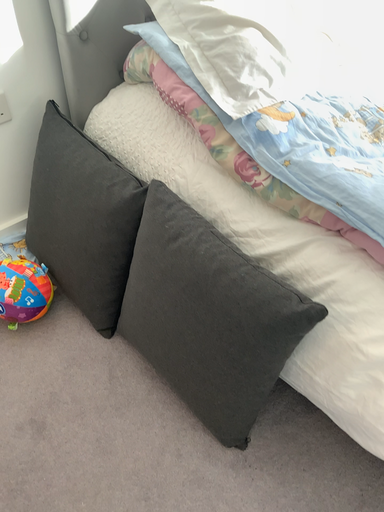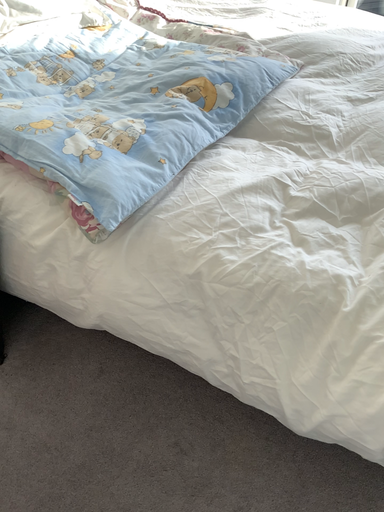
Question: How did the camera likely rotate when shooting the video?

Choices:
 (A) rotated right
 (B) rotated left

Answer: (A)